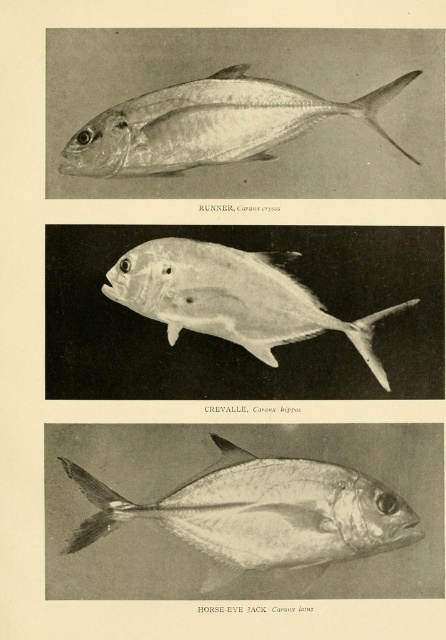
Between point (313, 115) and point (235, 250), which one is positioned in front?

Positioned in front is point (313, 115).

Which is more to the left, silver metallic fish at upper center or silver metallic fish at center?

From the viewer's perspective, silver metallic fish at upper center appears more on the left side.

The height and width of the screenshot is (640, 446). What do you see at coordinates (209, 124) in the screenshot? I see `silver metallic fish at upper center` at bounding box center [209, 124].

Identify the location of silver metallic fish at upper center. This screenshot has height=640, width=446. (209, 124).

Does shiny silver fish at center appear over silver metallic fish at upper center?

No, shiny silver fish at center is not above silver metallic fish at upper center.

Who is more forward, (300, 509) or (252, 141)?

Point (300, 509) is more forward.

Describe the element at coordinates (261, 515) in the screenshot. This screenshot has height=640, width=446. I see `shiny silver fish at center` at that location.

Locate an element on the screen. shiny silver fish at center is located at coordinates (261, 515).

Which is more to the right, shiny silver fish at center or silver metallic fish at center?

silver metallic fish at center

Measure the distance from shiny silver fish at center to silver metallic fish at center.

shiny silver fish at center and silver metallic fish at center are 10.36 inches apart from each other.

Between point (317, 557) and point (265, 360), which one is positioned in front?

Positioned in front is point (317, 557).

Image resolution: width=446 pixels, height=640 pixels. I want to click on shiny silver fish at center, so click(x=261, y=515).